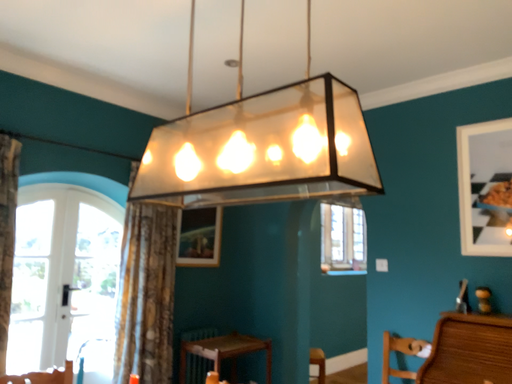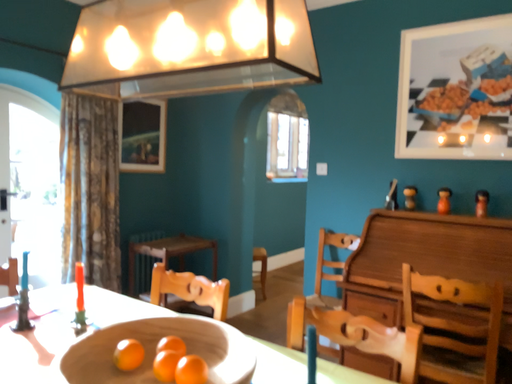
Question: How did the camera likely rotate when shooting the video?

Choices:
 (A) rotated upward
 (B) rotated downward

Answer: (B)